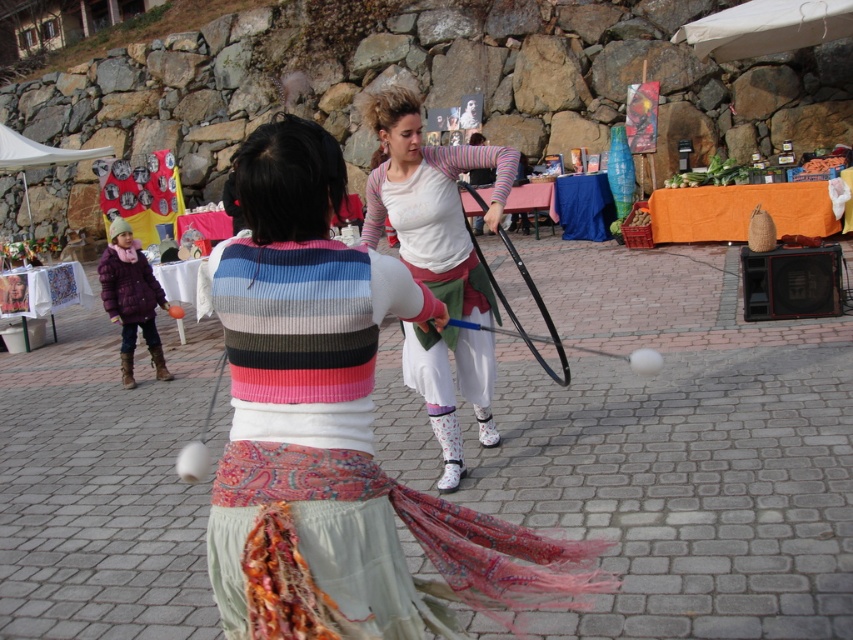
Is striped sweater at center positioned behind purple fuzzy coat at lower left?

No.

Can you confirm if striped sweater at center is thinner than purple fuzzy coat at lower left?

No, striped sweater at center is not thinner than purple fuzzy coat at lower left.

Does point (460, 561) lie behind point (119, 260)?

No, it is in front of (119, 260).

Where is `striped sweater at center`? striped sweater at center is located at coordinates 335,433.

Is white cotton shirt at center taller than purple fuzzy coat at lower left?

Yes.

In the scene shown: Is white cotton shirt at center bigger than purple fuzzy coat at lower left?

Indeed, white cotton shirt at center has a larger size compared to purple fuzzy coat at lower left.

Which is behind, point (399, 216) or point (126, 307)?

Positioned behind is point (126, 307).

Where is `white cotton shirt at center`? The width and height of the screenshot is (853, 640). white cotton shirt at center is located at coordinates (431, 202).

Describe the element at coordinates (335, 433) in the screenshot. The height and width of the screenshot is (640, 853). I see `striped sweater at center` at that location.

Does striped sweater at center have a larger size compared to white cotton shirt at center?

Yes.

Does point (265, 512) come behind point (489, 440)?

No, (265, 512) is closer to viewer.

Where is `striped sweater at center`? The height and width of the screenshot is (640, 853). striped sweater at center is located at coordinates (335, 433).